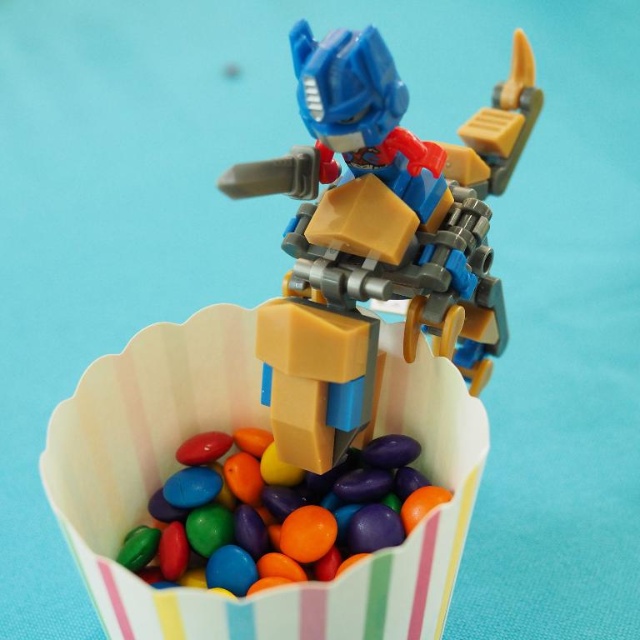
Question: Which point appears closest to the camera in this image?

Choices:
 (A) (x=440, y=157)
 (B) (x=420, y=481)

Answer: (A)

Question: Does matte plastic robot at center appear under glossy plastic candy at center?

Choices:
 (A) yes
 (B) no

Answer: (B)

Question: Can you confirm if matte plastic robot at center is wider than glossy plastic candy at center?

Choices:
 (A) no
 (B) yes

Answer: (B)

Question: Does matte plastic robot at center have a smaller size compared to glossy plastic candy at center?

Choices:
 (A) yes
 (B) no

Answer: (B)

Question: Which object appears farthest from the camera in this image?

Choices:
 (A) glossy plastic candy at center
 (B) matte plastic robot at center

Answer: (A)